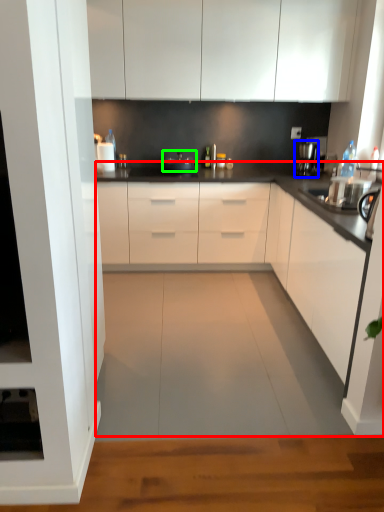
Question: Considering the real-world distances, which object is farthest from countertop (highlighted by a red box)? coffee machine (highlighted by a blue box) or appliance (highlighted by a green box)?

Choices:
 (A) coffee machine
 (B) appliance

Answer: (A)